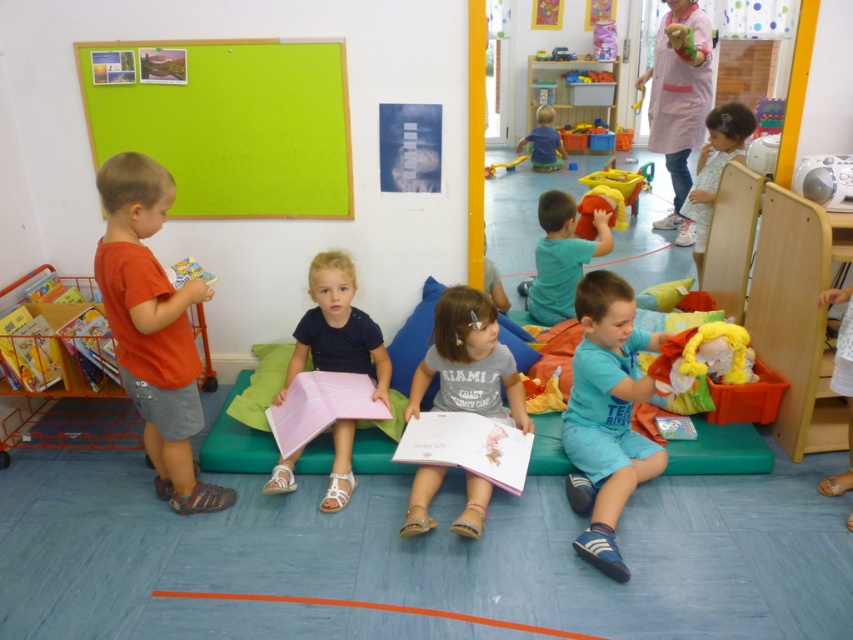
You are a teacher organizing a classroom. You need to place a small plant that is 15 cm tall on a shelf. The shelf has limited height clearance. Based on the image, can the matte pink book at center and the yellow plastic slide at center both fit vertically on the shelf without exceeding the 15 cm height limit?

The matte pink book at center is taller than the yellow plastic slide at center. Since the plant is 15 cm tall, if the slide is shorter than 15 cm, the book might exceed the height limit. However, without exact measurements, it is uncertain. Please check the actual dimensions.

You are a parent trying to hand your child a toy. You are standing at the center of the room. The soft plush toy at center is on the floor, and the plush yellow doll at upper right is on a shelf. Which toy is farther away from the other?

The distance between the soft plush toy at center and the plush yellow doll at upper right is 1.09 meters, so they are 1.09 meters apart from each other.